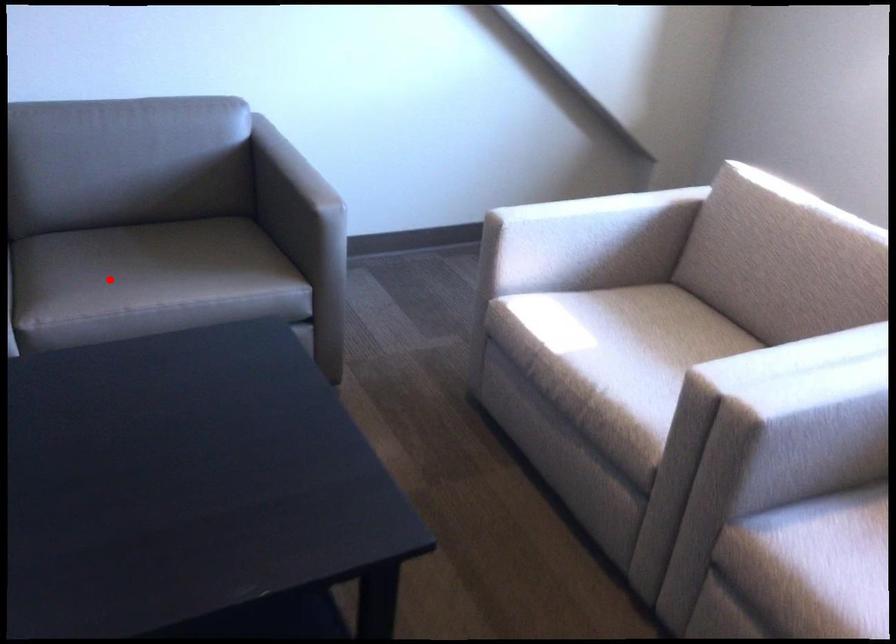
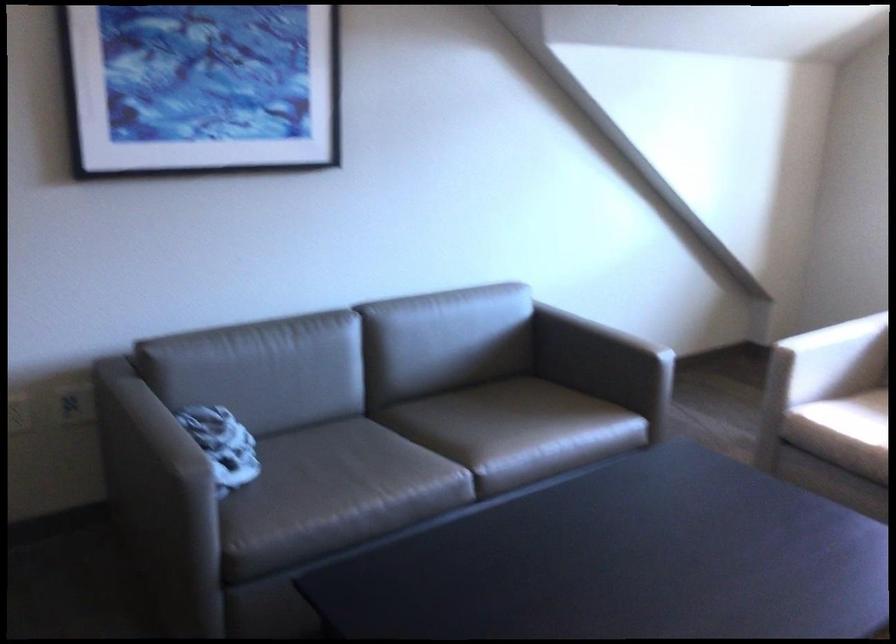
Find the pixel in the second image that matches the highlighted location in the first image.

(497, 430)